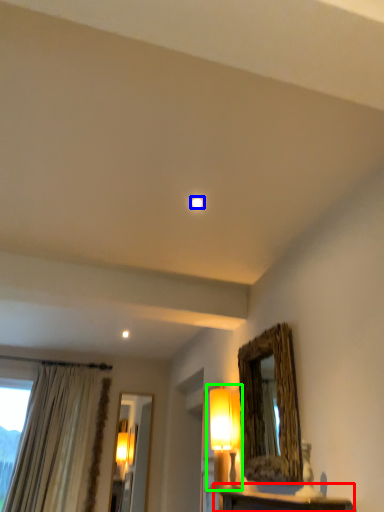
Question: Estimate the real-world distances between objects in this image. Which object is farther from table (highlighted by a red box), lighting (highlighted by a blue box) or table lamp (highlighted by a green box)?

Choices:
 (A) lighting
 (B) table lamp

Answer: (A)